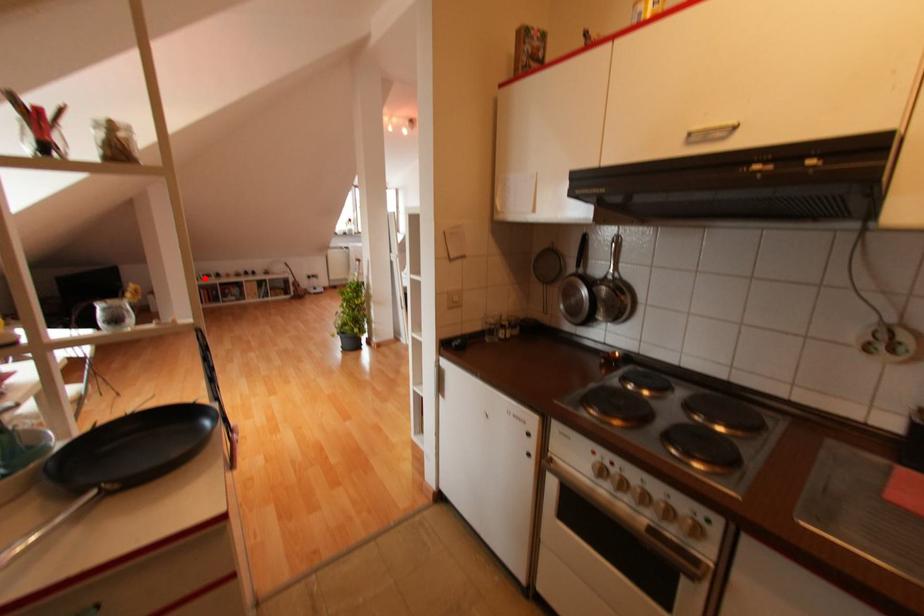
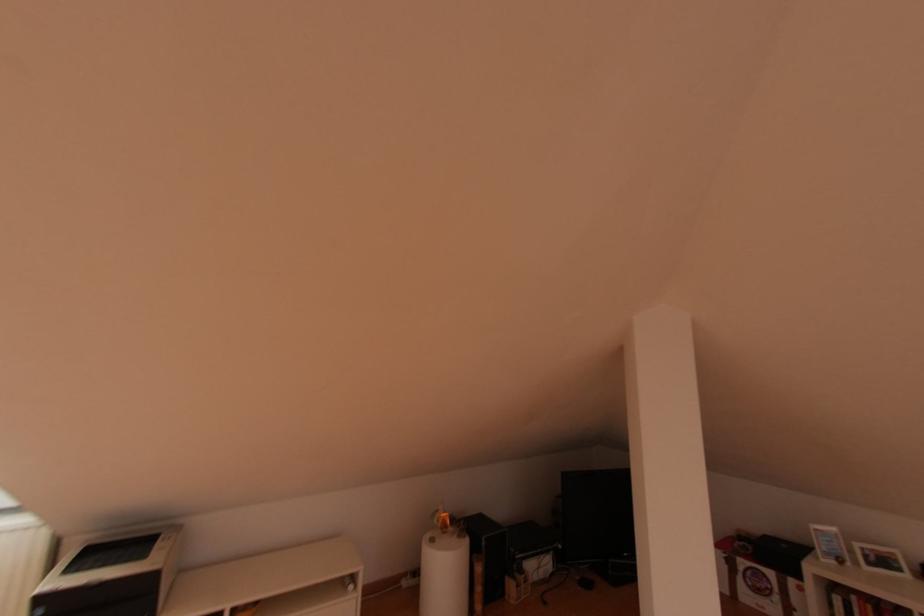
Question: I am providing you with two images of the same scene from different viewpoints. In image1, a red point is highlighted. Considering the same 3D point in image2, which of the following is correct?

Choices:
 (A) It is closer
 (B) It is farther

Answer: (A)